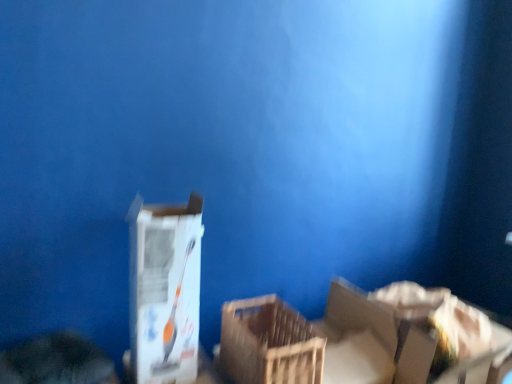
Question: Is point pyautogui.click(x=226, y=350) closer or farther from the camera than point pyautogui.click(x=175, y=367)?

Choices:
 (A) farther
 (B) closer

Answer: (A)

Question: Looking at the image, does wooden crate at center seem bigger or smaller compared to white cardboard box at center?

Choices:
 (A) small
 (B) big

Answer: (A)

Question: Which object is the closest to the white cardboard box at lower right?

Choices:
 (A) white cardboard box at center
 (B) wooden crate at center

Answer: (B)

Question: Which object is positioned closest to the white cardboard box at lower right?

Choices:
 (A) wooden crate at center
 (B) white cardboard box at center

Answer: (A)